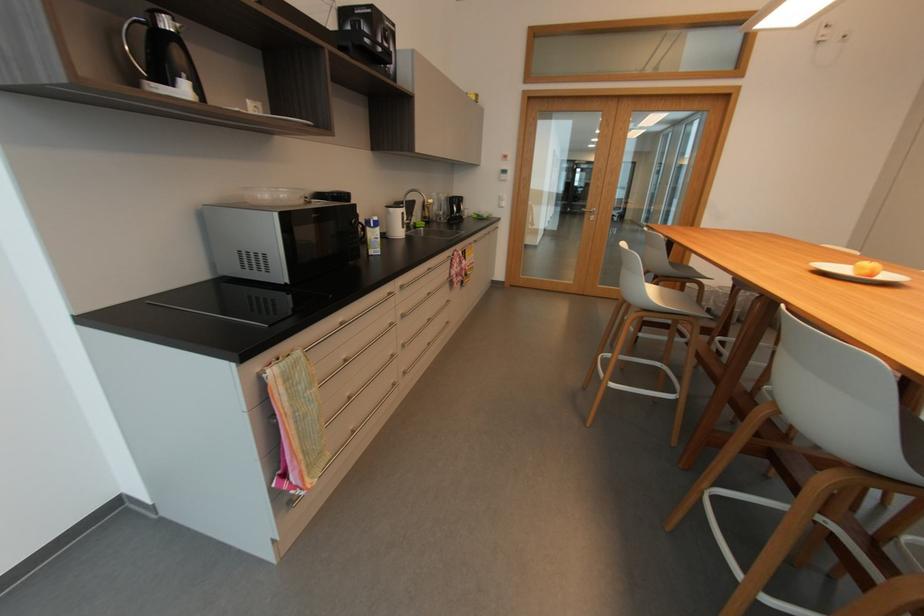
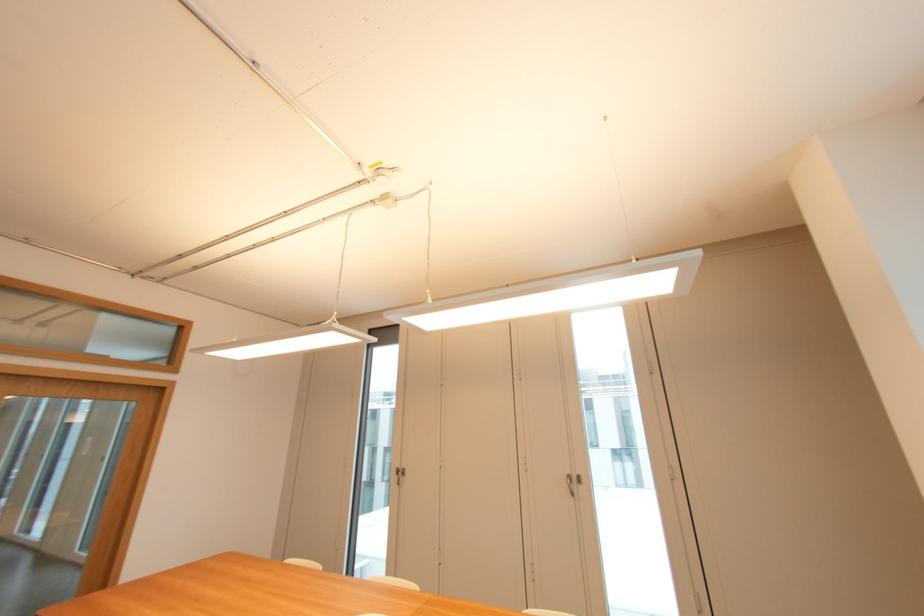
The images are taken continuously from a first-person perspective. In which direction is your viewpoint rotating?

The camera rotated toward right-up.